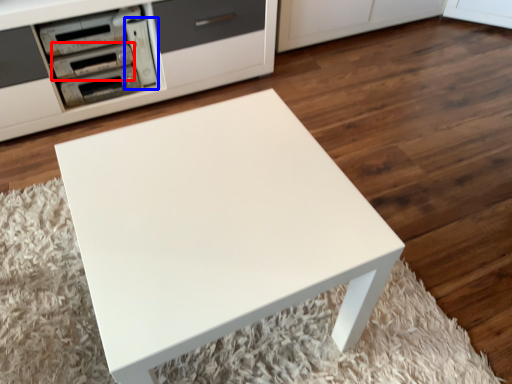
Question: Which object appears farthest to the camera in this image, appliance (highlighted by a red box) or appliance (highlighted by a blue box)?

Choices:
 (A) appliance
 (B) appliance

Answer: (B)